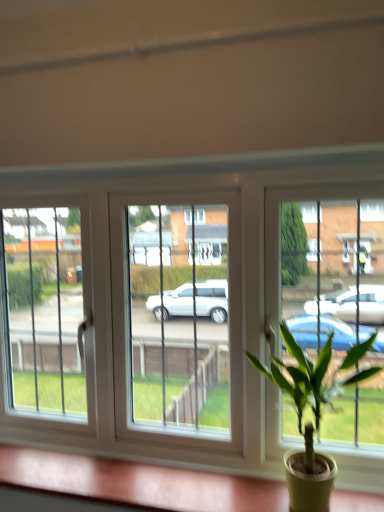
What do you see at coordinates (130, 484) in the screenshot? The image size is (384, 512). I see `green matte plant pot at lower right` at bounding box center [130, 484].

Locate an element on the screen. The height and width of the screenshot is (512, 384). green matte plant pot at lower right is located at coordinates (130, 484).

This screenshot has width=384, height=512. What do you see at coordinates (308, 386) in the screenshot? I see `green leafy plant in pot at center` at bounding box center [308, 386].

In order to face green leafy plant in pot at center, should I rotate leftwards or rightwards?

It's best to rotate right around 15.060 degrees.

At what (x,y) coordinates should I click in order to perform the action: click on green leafy plant in pot at center. Please return your answer as a coordinate pair (x, y). The height and width of the screenshot is (512, 384). Looking at the image, I should click on (308, 386).

Locate an element on the screen. The image size is (384, 512). green matte plant pot at lower right is located at coordinates (130, 484).

Is green leafy plant in pot at center to the left of green matte plant pot at lower right from the viewer's perspective?

No.

Is green leafy plant in pot at center positioned in front of green matte plant pot at lower right?

Yes, green leafy plant in pot at center is closer to the camera.

Is point (311, 445) closer to camera compared to point (377, 501)?

Yes, it is in front of point (377, 501).

From the image's perspective, is green leafy plant in pot at center located above green matte plant pot at lower right?

Yes, from the image's perspective, green leafy plant in pot at center is above green matte plant pot at lower right.

From a real-world perspective, which object stands above the other?

From a 3D spatial view, green leafy plant in pot at center is above.

Considering the sizes of green leafy plant in pot at center and green matte plant pot at lower right in the image, is green leafy plant in pot at center wider or thinner than green matte plant pot at lower right?

In the image, green leafy plant in pot at center appears to be wider than green matte plant pot at lower right.

Who is taller, green leafy plant in pot at center or green matte plant pot at lower right?

Standing taller between the two is green leafy plant in pot at center.

Who is smaller, green leafy plant in pot at center or green matte plant pot at lower right?

green matte plant pot at lower right.

Is green leafy plant in pot at center inside or outside of green matte plant pot at lower right?

green leafy plant in pot at center is outside green matte plant pot at lower right.

Is green leafy plant in pot at center beside green matte plant pot at lower right?

green leafy plant in pot at center and green matte plant pot at lower right are not in contact.

In the scene shown: Is green leafy plant in pot at center positioned with its back to green matte plant pot at lower right?

green leafy plant in pot at center is not turned away from green matte plant pot at lower right.

How different are the orientations of green leafy plant in pot at center and green matte plant pot at lower right in degrees?

0.533 degrees.

How distant is green leafy plant in pot at center from green matte plant pot at lower right?

green leafy plant in pot at center is 37.36 centimeters away from green matte plant pot at lower right.

Where is `houseplant that appears above the green matte plant pot at lower right (from a real-world perspective)`? The height and width of the screenshot is (512, 384). houseplant that appears above the green matte plant pot at lower right (from a real-world perspective) is located at coordinates (308, 386).

Considering the positions of objects green matte plant pot at lower right and green leafy plant in pot at center in the image provided, who is more to the left, green matte plant pot at lower right or green leafy plant in pot at center?

green matte plant pot at lower right.

Considering the positions of objects green matte plant pot at lower right and green leafy plant in pot at center in the image provided, who is behind, green matte plant pot at lower right or green leafy plant in pot at center?

Positioned behind is green matte plant pot at lower right.

Does point (109, 463) appear closer or farther from the camera than point (311, 497)?

Point (109, 463) is positioned farther from the camera compared to point (311, 497).

From the image's perspective, which one is positioned higher, green matte plant pot at lower right or green leafy plant in pot at center?

From the image's view, green leafy plant in pot at center is above.

From a real-world perspective, is green matte plant pot at lower right physically located above or below green leafy plant in pot at center?

green matte plant pot at lower right is situated lower than green leafy plant in pot at center in the real world.

Which of these two, green matte plant pot at lower right or green leafy plant in pot at center, is thinner?

green matte plant pot at lower right.

Does green matte plant pot at lower right have a greater height compared to green leafy plant in pot at center?

No, green matte plant pot at lower right is not taller than green leafy plant in pot at center.

Between green matte plant pot at lower right and green leafy plant in pot at center, which one has larger size?

green leafy plant in pot at center is bigger.

Is green matte plant pot at lower right situated inside green leafy plant in pot at center or outside?

The correct answer is: outside.

Is green matte plant pot at lower right far from green leafy plant in pot at center?

No, there isn't a large distance between green matte plant pot at lower right and green leafy plant in pot at center.

Is green leafy plant in pot at center at the back of green matte plant pot at lower right?

No.

How much distance is there between green matte plant pot at lower right and green leafy plant in pot at center?

They are 14.71 inches apart.

I want to click on window sill below the green leafy plant in pot at center (from the image's perspective), so click(130, 484).

You are a GUI agent. You are given a task and a screenshot of the screen. Output one action in this format:
    pyautogui.click(x=<x>, y=<y>)
    Task: Click on the window sill that appears on the left of green leafy plant in pot at center
    
    Given the screenshot: What is the action you would take?
    pyautogui.click(x=130, y=484)

You are a GUI agent. You are given a task and a screenshot of the screen. Output one action in this format:
    pyautogui.click(x=<x>, y=<y>)
    Task: Click on the window sill below the green leafy plant in pot at center (from a real-world perspective)
    Image resolution: width=384 pixels, height=512 pixels.
    Given the screenshot: What is the action you would take?
    pyautogui.click(x=130, y=484)